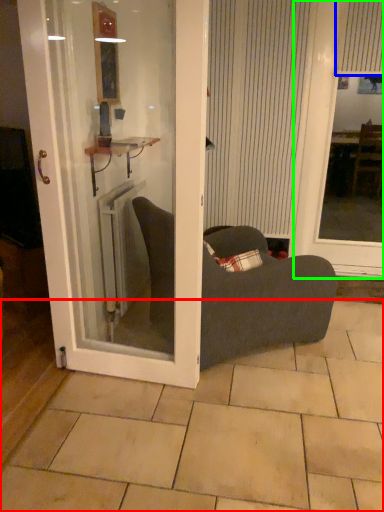
Question: Estimate the real-world distances between objects in this image. Which object is farther from tile (highlighted by a red box), curtain (highlighted by a blue box) or window screen (highlighted by a green box)?

Choices:
 (A) curtain
 (B) window screen

Answer: (A)